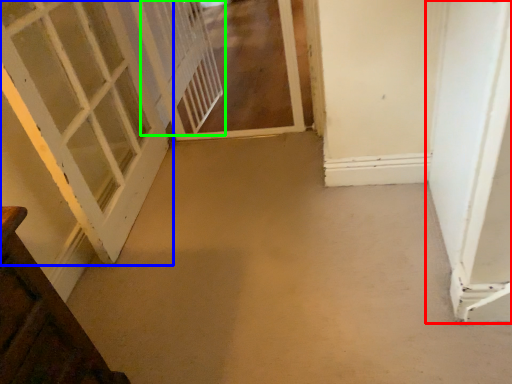
Question: Which object is positioned closest to door (highlighted by a red box)? Select from door (highlighted by a blue box) and screen door (highlighted by a green box).

Choices:
 (A) door
 (B) screen door

Answer: (A)